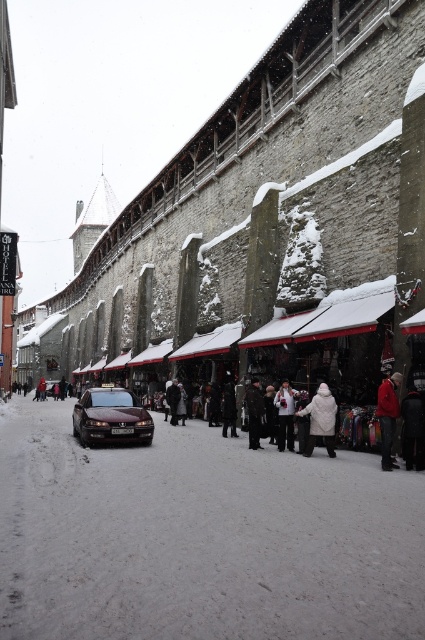
You are a photographer setting up a tripod in the snowy street scene. You need to place the tripod between the red woolen jacket at lower right and the dark brown fur coat at center. Considering their sizes, which jacket should you avoid placing the tripod next to to ensure enough space?

You should avoid placing the tripod next to the red woolen jacket at lower right because its width is larger than the dark brown fur coat at center, which means it occupies more space and might interfere with the tripod setup.

You are a tourist in this snowy town and want to take a photo of the historic stone wall with the red woolen jacket at lower right and the dark brown fur coat at center. Which clothing item will appear larger in the photo?

The red woolen jacket at lower right will appear larger in the photo because it is much taller than the dark brown fur coat at center.